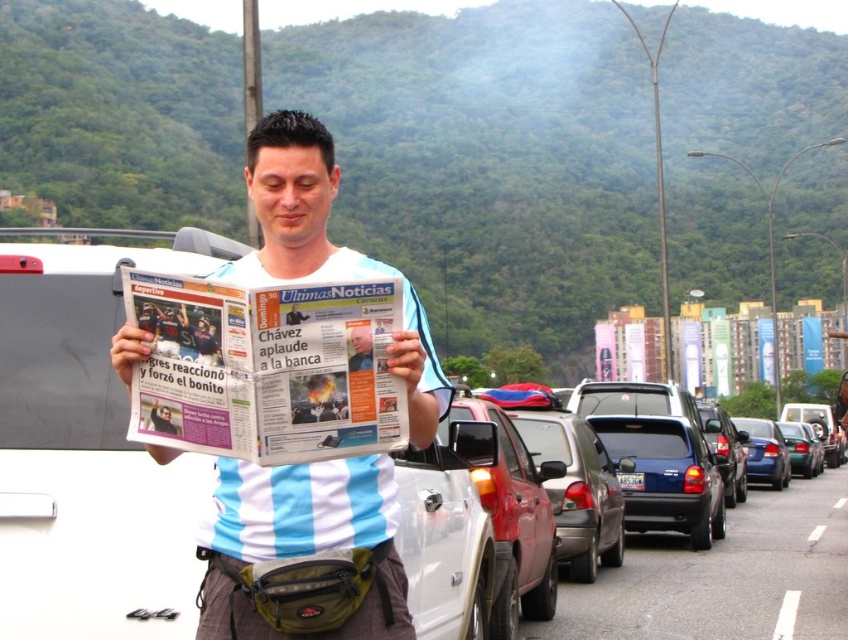
You are a photographer trying to capture a clear shot of the white cotton shirt at center and the blue plastic license plate at center. Which object should you zoom in on to ensure it fills the frame without cropping?

The white cotton shirt at center has a larger size compared to the blue plastic license plate at center, so you should zoom in on the white cotton shirt at center to ensure it fills the frame without cropping.

You are a delivery person who needs to deliver a package to the shiny blue sedan at center right. You are currently standing at the point with coordinates (667, 476). Can you reach the shiny blue sedan at center right directly from your current position?

The point at (667, 476) is already on the shiny blue sedan at center right, so you are already at the correct location to deliver the package.